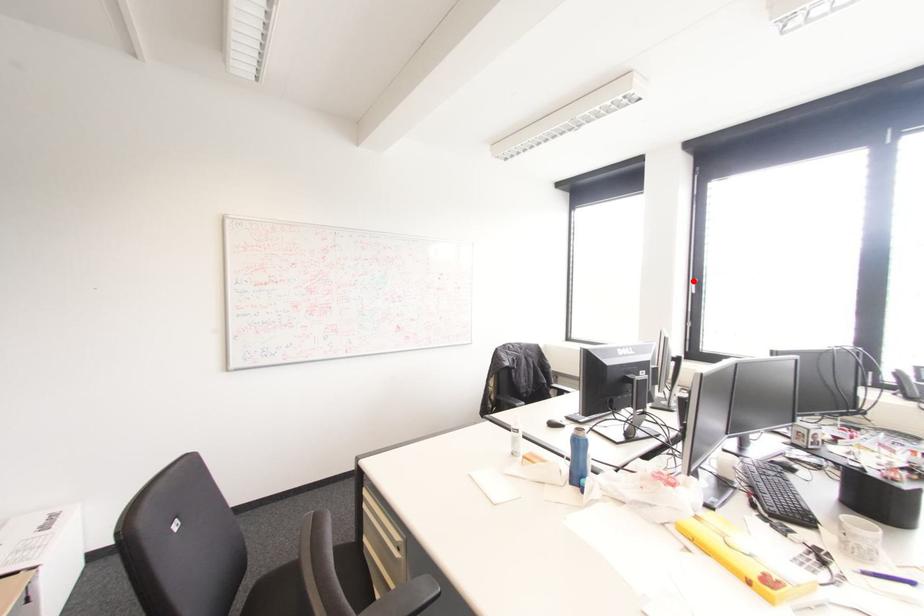
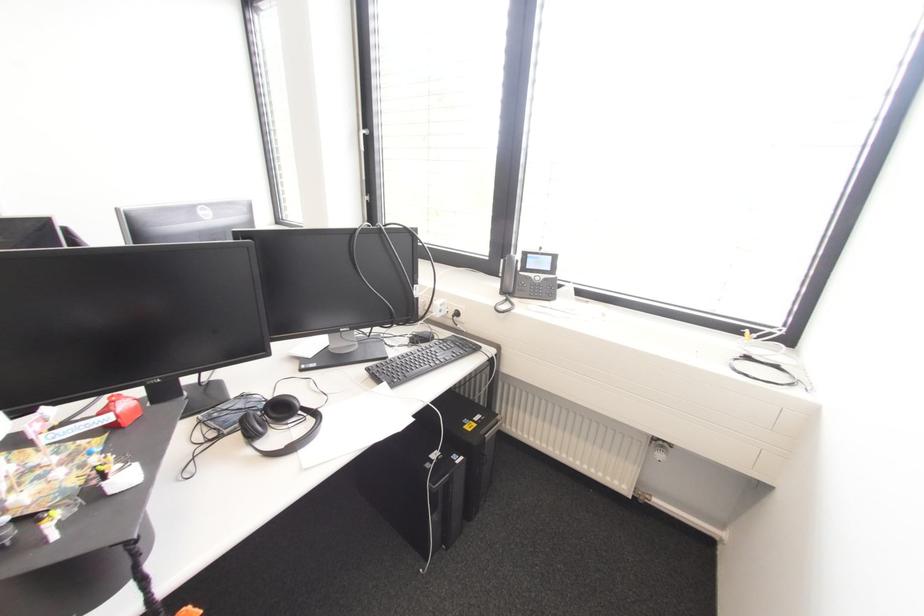
Where in the second image is the point corresponding to the highlighted location from the first image?

(361, 132)